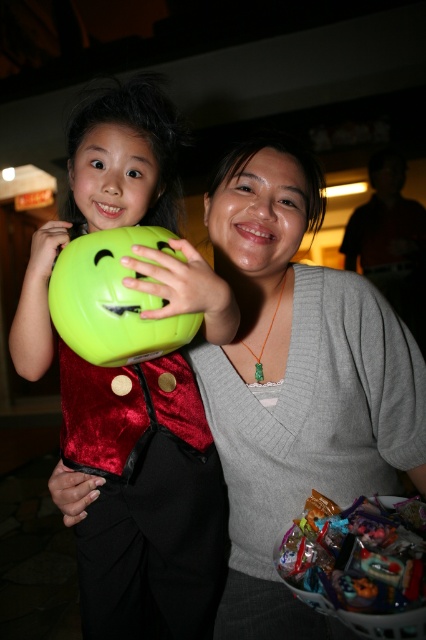
Question: Can you confirm if matte gray sweater at center is positioned to the left of green matte balloon at center?

Choices:
 (A) no
 (B) yes

Answer: (A)

Question: Is matte gray sweater at center further to camera compared to matte green helmet at center?

Choices:
 (A) no
 (B) yes

Answer: (B)

Question: Among these points, which one is farthest from the camera?

Choices:
 (A) (196, 502)
 (B) (302, 387)
 (C) (132, 314)

Answer: (A)

Question: Which of the following is the farthest from the observer?

Choices:
 (A) (178, 148)
 (B) (258, 410)
 (C) (117, 316)

Answer: (A)

Question: Which is nearer to the green matte balloon at center?

Choices:
 (A) matte gray sweater at center
 (B) matte green helmet at center

Answer: (B)

Question: Is matte green helmet at center above green matte balloon at center?

Choices:
 (A) no
 (B) yes

Answer: (A)